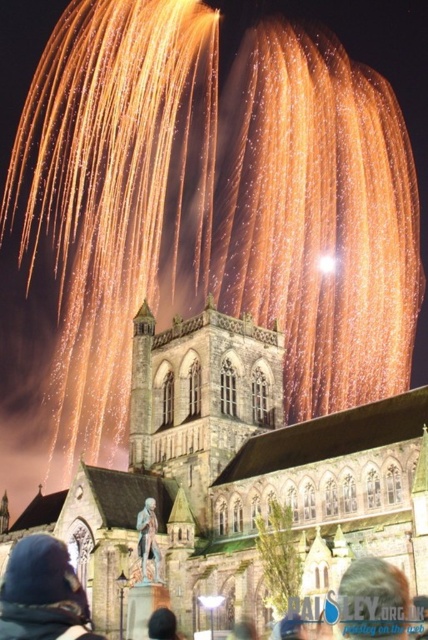
Question: Based on their relative distances, which object is farther from the stone church at center?

Choices:
 (A) blonde hair at center
 (B) dark blue knit hat at lower left
 (C) black fabric at lower center

Answer: (A)

Question: Is stone church at center positioned at the back of dark blue knit hat at lower left?

Choices:
 (A) yes
 (B) no

Answer: (A)

Question: Does dark blue knit hat at lower left have a smaller size compared to blonde hair at center?

Choices:
 (A) yes
 (B) no

Answer: (B)

Question: Which of the following is the closest to the observer?

Choices:
 (A) (365, 456)
 (B) (366, 616)
 (C) (33, 550)

Answer: (C)

Question: Which of the following is the closest to the observer?

Choices:
 (A) (79, 596)
 (B) (190, 360)
 (C) (372, 588)

Answer: (A)

Question: Does blonde hair at center have a greater width compared to polished bronze statue at lower center?

Choices:
 (A) no
 (B) yes

Answer: (A)